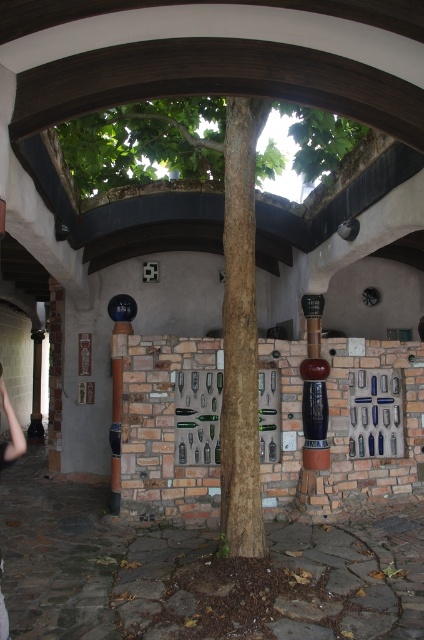
You are standing in the courtyard and want to take a photo of the shiny dark wood pillar at center and the skinny jeans at lower left. Which object should you focus on first if you want to capture both in a single frame without moving the camera?

You should focus on the shiny dark wood pillar at center first because it is much taller than the skinny jeans at lower left, so it will occupy more space in the frame and ensure both are visible.

You are an architect designing a new courtyard and want to ensure the green leafy tree at center and the shiny dark wood pillar at center are proportionate. Based on the image, which object should you scale down to achieve balance?

The green leafy tree at center is larger than the shiny dark wood pillar at center. To achieve balance, you should scale down the green leafy tree at center to match the size of the shiny dark wood pillar at center.

You are an architect designing a new courtyard and want to ensure the green leafy tree at center and shiny dark wood pillar at center fit within a 2.5 meter wide space. Based on their widths, can both objects fit side by side without overlapping?

The green leafy tree at center is wider than the shiny dark wood pillar at center. To determine if they can fit side by side within 2.5 meters, you need to know the exact widths of both. However, since the tree is wider, if their combined widths exceed 2.5 meters, they won